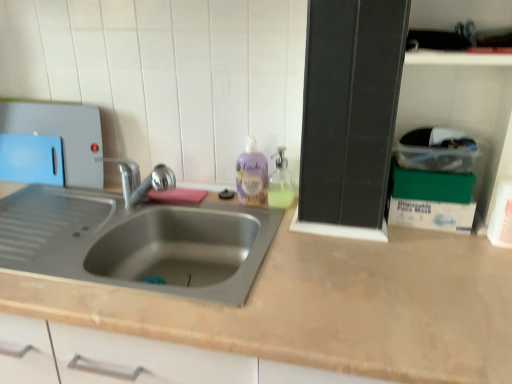
Question: Can you confirm if blue plastic cutting board at left is shorter than translucent plastic soap dispenser at upper right?

Choices:
 (A) yes
 (B) no

Answer: (B)

Question: Can you confirm if blue plastic cutting board at left is taller than translucent plastic soap dispenser at upper right?

Choices:
 (A) no
 (B) yes

Answer: (B)

Question: Considering the relative positions of blue plastic cutting board at left and translucent plastic soap dispenser at upper right in the image provided, is blue plastic cutting board at left to the right of translucent plastic soap dispenser at upper right from the viewer's perspective?

Choices:
 (A) yes
 (B) no

Answer: (B)

Question: Does blue plastic cutting board at left have a smaller size compared to translucent plastic soap dispenser at upper right?

Choices:
 (A) yes
 (B) no

Answer: (B)

Question: Is translucent plastic soap dispenser at upper right inside blue plastic cutting board at left?

Choices:
 (A) no
 (B) yes

Answer: (A)

Question: Based on their sizes in the image, would you say purple translucent liquid soap at center is bigger or smaller than green cardboard box at right, which appears as the 1th box when ordered from the bottom?

Choices:
 (A) big
 (B) small

Answer: (A)

Question: From a real-world perspective, relative to green cardboard box at right, which appears as the third box when viewed from the top, is purple translucent liquid soap at center vertically above or below?

Choices:
 (A) below
 (B) above

Answer: (B)

Question: Looking at their shapes, would you say purple translucent liquid soap at center is wider or thinner than green cardboard box at right, which appears as the 1th box when ordered from the bottom?

Choices:
 (A) thin
 (B) wide

Answer: (A)

Question: Considering the positions of point (240, 195) and point (445, 201), is point (240, 195) closer or farther from the camera than point (445, 201)?

Choices:
 (A) farther
 (B) closer

Answer: (A)

Question: Is point (418, 148) positioned closer to the camera than point (432, 201)?

Choices:
 (A) farther
 (B) closer

Answer: (B)

Question: Considering the positions of clear plastic container at upper right, which appears as the third box when ordered from the bottom, and green cardboard box at right, which appears as the third box when viewed from the top, in the image, is clear plastic container at upper right, which appears as the third box when ordered from the bottom, wider or thinner than green cardboard box at right, which appears as the third box when viewed from the top,?

Choices:
 (A) wide
 (B) thin

Answer: (A)

Question: Which is correct: clear plastic container at upper right, which is the 1th box from top to bottom, is inside green cardboard box at right, which appears as the 1th box when ordered from the bottom, or outside of it?

Choices:
 (A) outside
 (B) inside

Answer: (A)

Question: From a real-world perspective, is clear plastic container at upper right, which is the 1th box from top to bottom, positioned above or below green cardboard box at right, which appears as the third box when viewed from the top?

Choices:
 (A) below
 (B) above

Answer: (B)

Question: Does point (460, 165) appear closer or farther from the camera than point (457, 193)?

Choices:
 (A) farther
 (B) closer

Answer: (B)

Question: Looking at their shapes, would you say clear plastic container at upper right, which is the 1th box from top to bottom, is wider or thinner than green cardboard box at upper right, which is the 2th box in top-to-bottom order?

Choices:
 (A) thin
 (B) wide

Answer: (B)